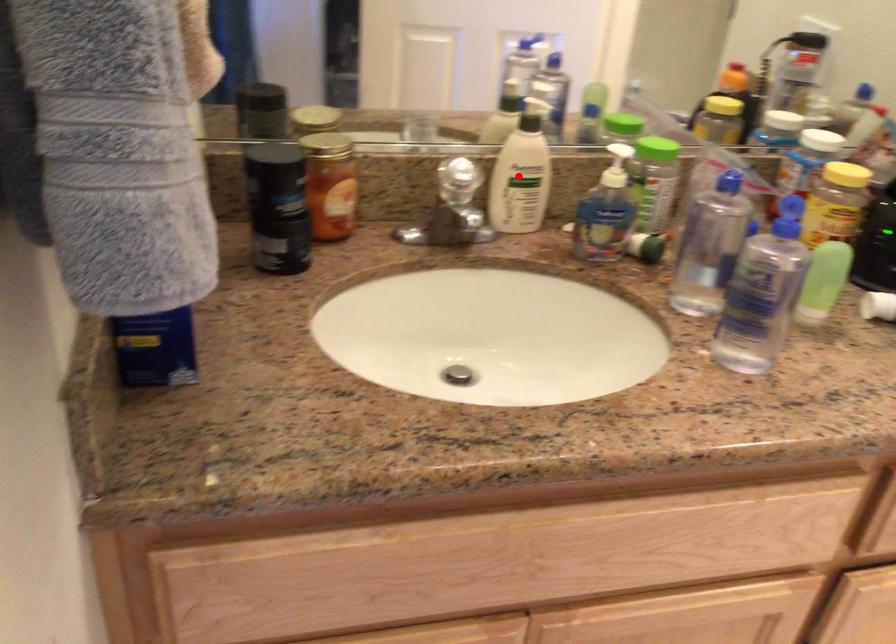
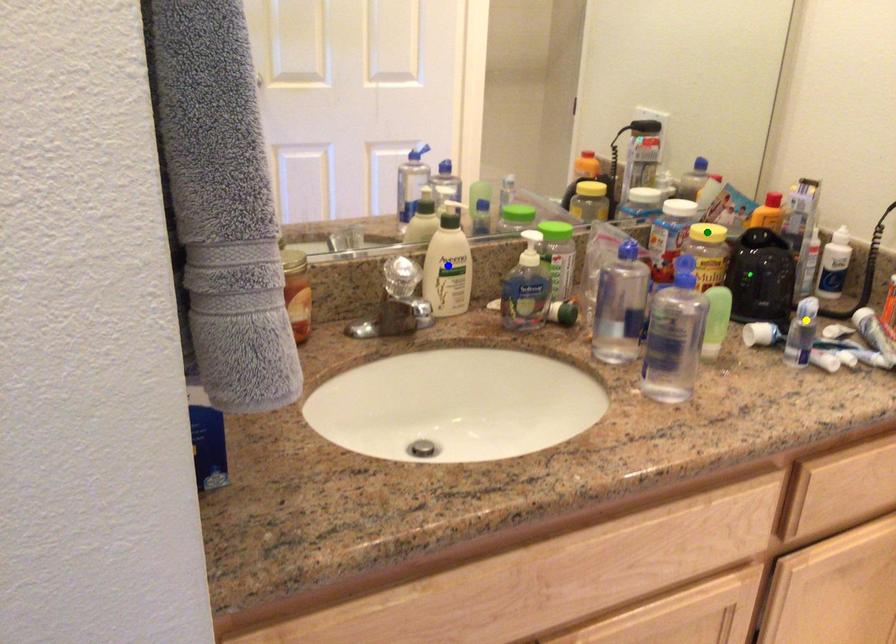
Question: I am providing you with two images of the same scene from different viewpoints. A red point is marked on the first image. You are given multiple points on the second image. Can you choose the point in image 2 that corresponds to the point in image 1?

Choices:
 (A) blue point
 (B) yellow point
 (C) green point

Answer: (A)